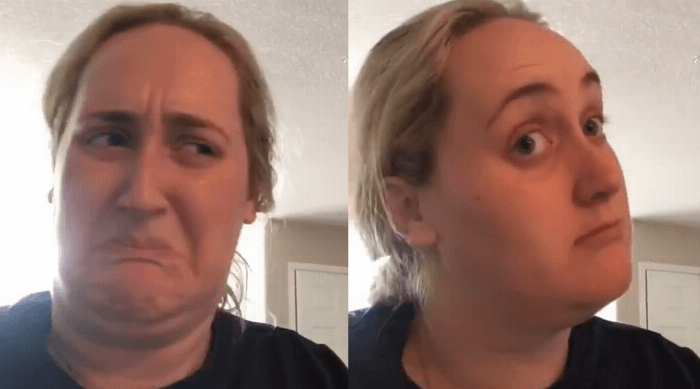
Where is `white door`? Image resolution: width=700 pixels, height=389 pixels. white door is located at coordinates (320, 303), (668, 300).